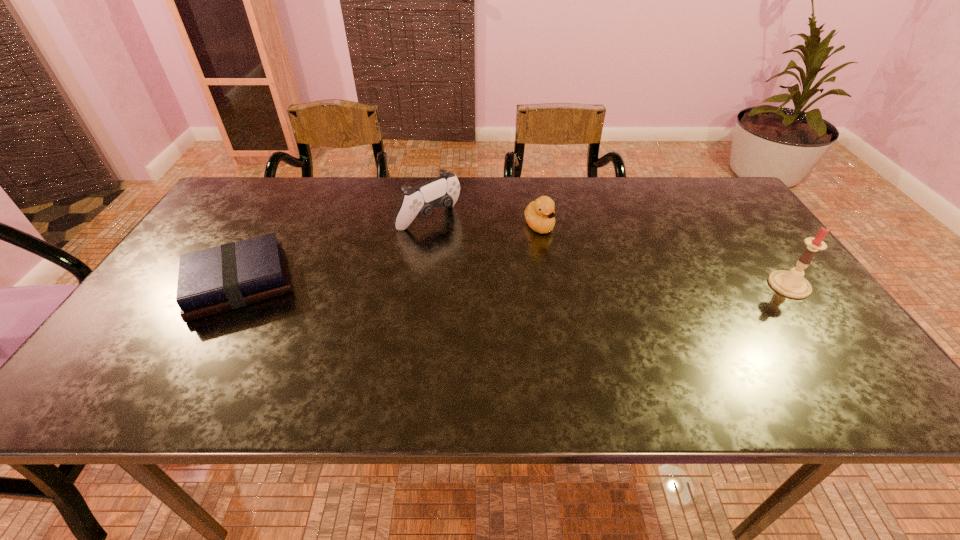
Image resolution: width=960 pixels, height=540 pixels. I want to click on the leftmost object, so (233, 275).

Locate an element on the screen. the shortest object is located at coordinates (233, 275).

Image resolution: width=960 pixels, height=540 pixels. Find the location of `the tallest object`. the tallest object is located at coordinates (792, 283).

Find the location of a particular element. The image size is (960, 540). candle is located at coordinates (792, 283).

Locate an element on the screen. This screenshot has width=960, height=540. the second tallest object is located at coordinates (443, 191).

Find the location of a particular element. the second object from left to right is located at coordinates (443, 191).

Where is `duckling`? Image resolution: width=960 pixels, height=540 pixels. duckling is located at coordinates (539, 214).

Identify the location of the second object from right to left. This screenshot has width=960, height=540. (539, 214).

At what (x,y) coordinates should I click in order to perform the action: click on free space located on the front of the book. Please return your answer as a coordinate pair (x, y). The height and width of the screenshot is (540, 960). Looking at the image, I should click on (197, 356).

This screenshot has width=960, height=540. I want to click on blank space located 0.330m on the back of the rightmost object, so click(728, 201).